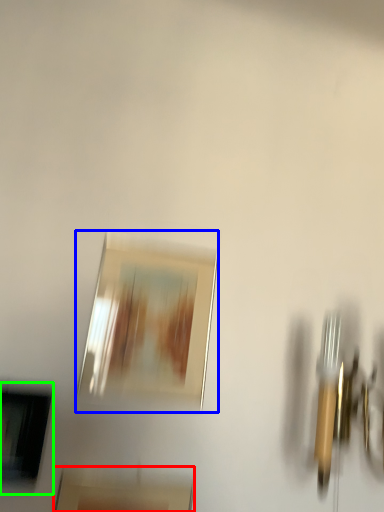
Question: Which is nearer to the picture frame (highlighted by a red box)? picture frame (highlighted by a blue box) or picture frame (highlighted by a green box).

Choices:
 (A) picture frame
 (B) picture frame

Answer: (B)